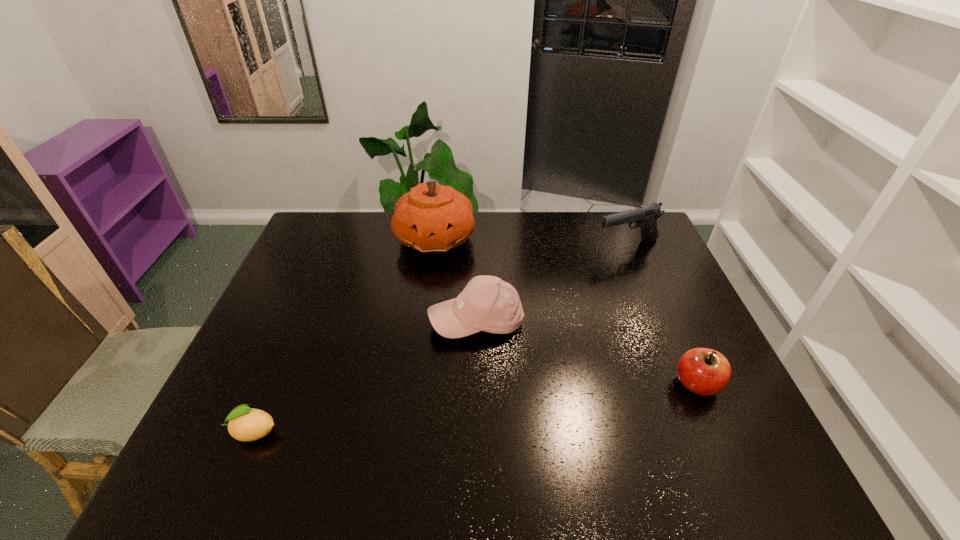
Identify the location of the shortest object. (245, 424).

Where is `the leftmost object`? The width and height of the screenshot is (960, 540). the leftmost object is located at coordinates (245, 424).

At what (x,y) coordinates should I click in order to perform the action: click on the second shortest object. Please return your answer as a coordinate pair (x, y). This screenshot has height=540, width=960. Looking at the image, I should click on (703, 371).

Where is `apple`? This screenshot has width=960, height=540. apple is located at coordinates (703, 371).

The height and width of the screenshot is (540, 960). In order to click on baseball cap in this screenshot , I will do `click(487, 303)`.

Locate an element on the screen. gun is located at coordinates (645, 217).

The image size is (960, 540). I want to click on the tallest object, so click(x=431, y=218).

You are a GUI agent. You are given a task and a screenshot of the screen. Output one action in this format:
    pyautogui.click(x=<x>, y=<y>)
    Task: Click on the vacant region located with leaves positioned above the shortest object
    
    Given the screenshot: What is the action you would take?
    pyautogui.click(x=206, y=431)

The width and height of the screenshot is (960, 540). What are the coordinates of `vacant space situated on the front of the second shortest object` in the screenshot? It's located at (719, 434).

Locate an element on the screen. Image resolution: width=960 pixels, height=540 pixels. vacant position located on the front-facing side of the third farthest object is located at coordinates (444, 379).